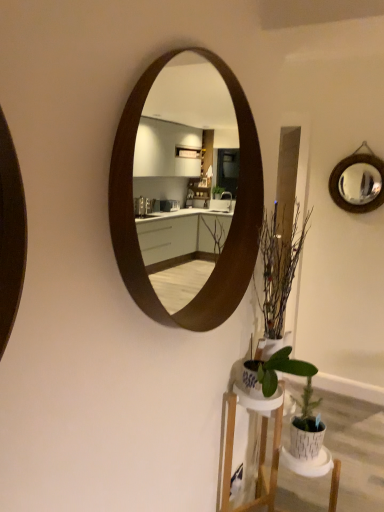
The height and width of the screenshot is (512, 384). Describe the element at coordinates (358, 182) in the screenshot. I see `shiny silver mirror at upper right` at that location.

In the scene shown: What is the approximate height of shiny silver mirror at upper right?

shiny silver mirror at upper right is 19.90 inches in height.

Measure the distance between shiny silver mirror at upper right and camera.

shiny silver mirror at upper right is 2.84 meters from camera.

Identify the location of shiny silver mirror at upper right. This screenshot has height=512, width=384. (358, 182).

Find the location of a particular element. shiny silver mirror at upper right is located at coordinates (358, 182).